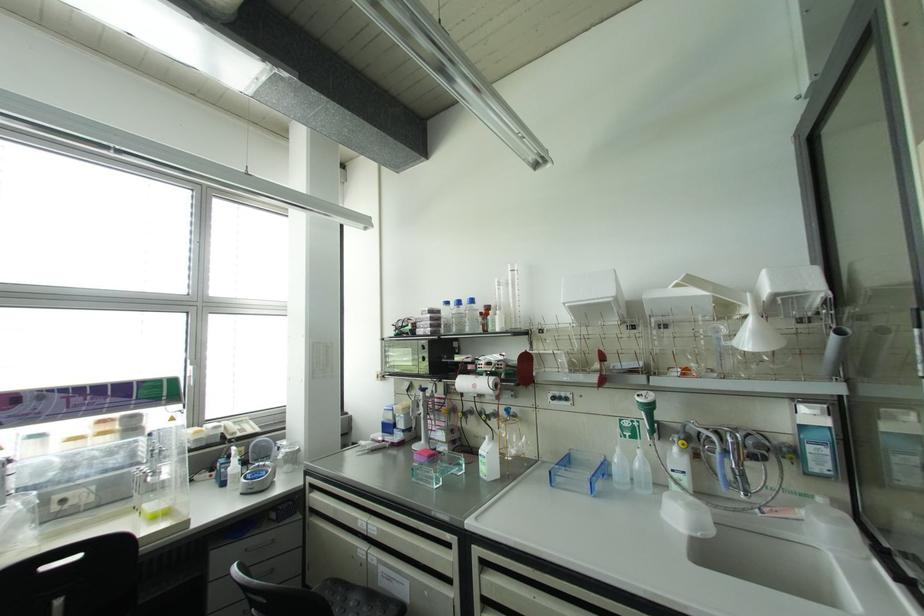
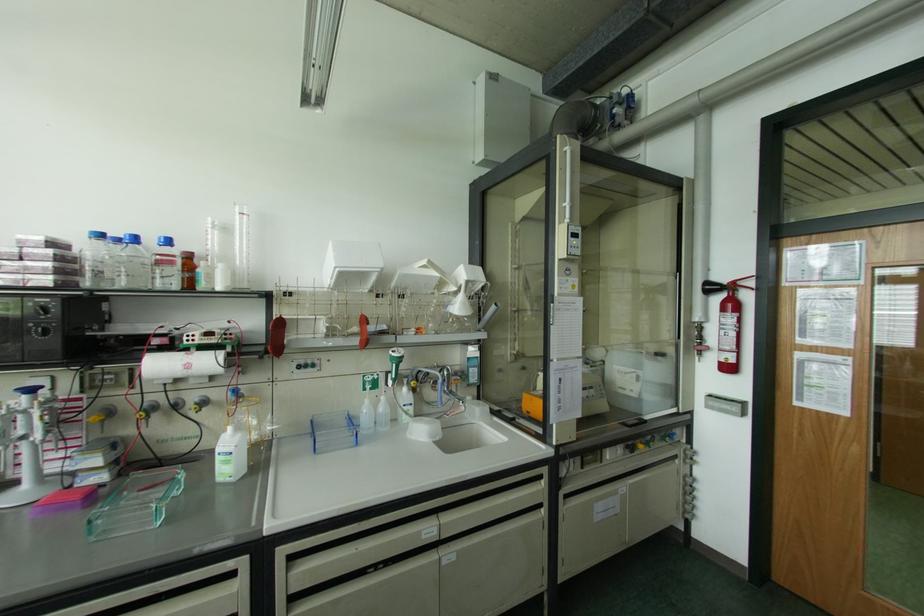
Find the pixel in the second image that matches pixel 508 272 in the first image.

(237, 216)